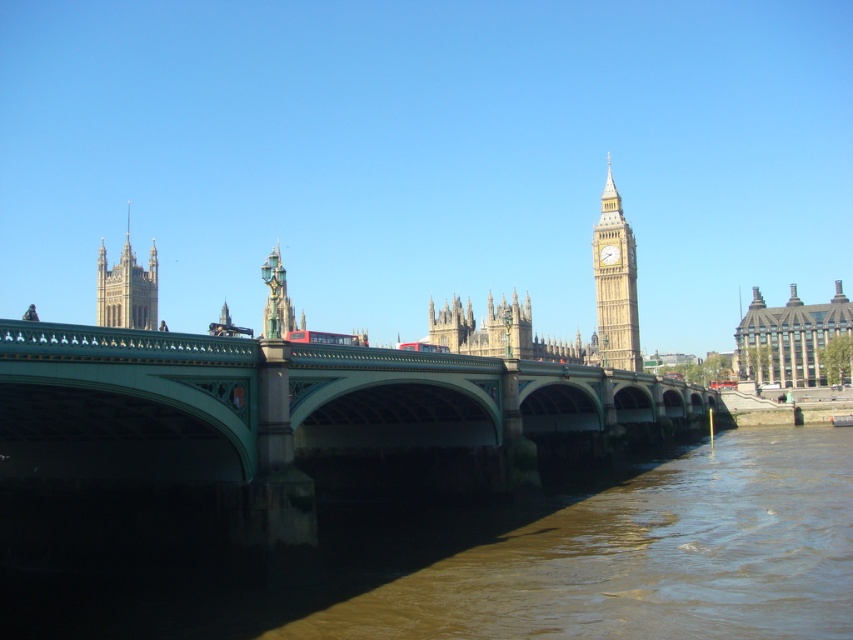
From the picture: You are a tourist standing on Westminster Bridge and notice the brown sedimentary water at lower left and the gray stone building at right. Which object occupies a larger area in the image?

The brown sedimentary water at lower left occupies a larger area in the image than the gray stone building at right.